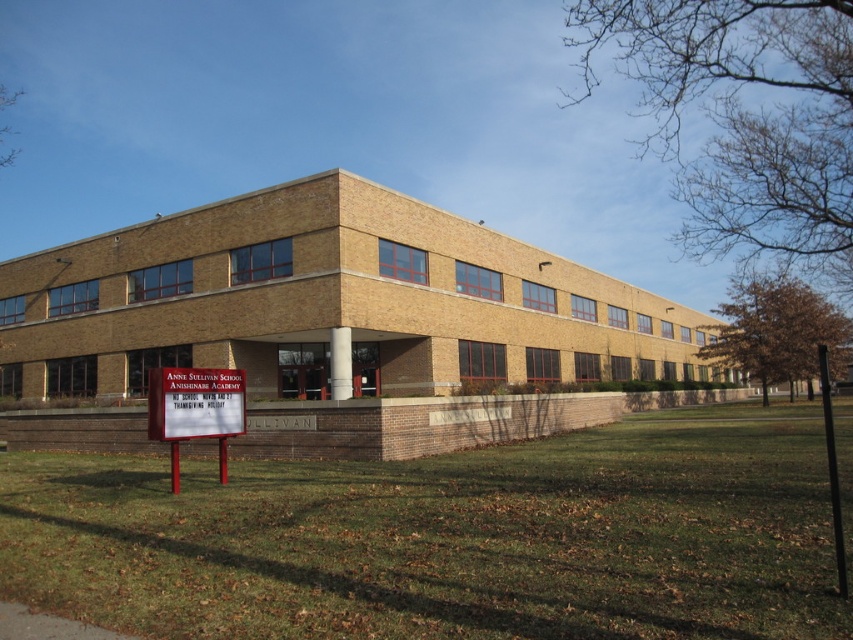
You are a delivery person trying to find the entrance of the Anne Sullivan School Anishinabe Academy. You see the brown brick building at center and the white plastic sign at lower left. Which object is larger and could help you locate the entrance more easily?

The brown brick building at center is bigger than the white plastic sign at lower left, so the building is larger and more prominent, making it easier to locate the entrance there.

You are a delivery person trying to park your van in front of the brown brick building at center. The parking space next to the red plastic sign at lower left is 1.2 meters wide. Can your van, which is 1.5 meters wide, fit into this space?

The brown brick building at center might be wider than the red plastic sign at lower left, but the parking space next to the red plastic sign at lower left is 1.2 meters wide, which is narrower than the van. Therefore, the van cannot fit into the space.

What are the coordinates of the brown brick building at center?

The coordinates of the brown brick building at center are point (344, 323).